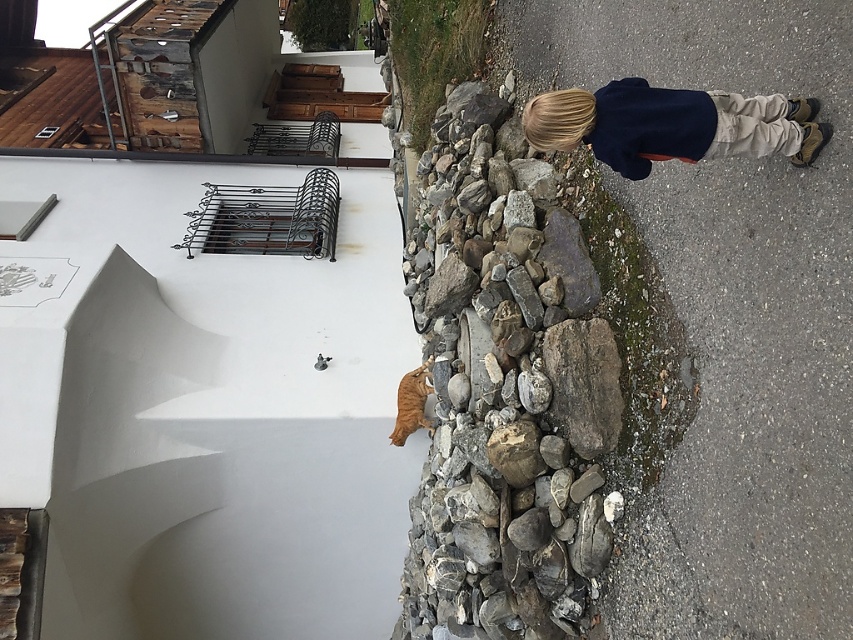
You are a hiker who wants to place your dark blue sweater at upper right on top of the rough gray rock at center. Based on the scene description, will the sweater fit on the rock?

The rough gray rock at center is much taller than the dark blue sweater at upper right, so the sweater will fit on the rock since the rock is larger in height.

In the scene shown: You are a hiker who has just arrived at the scene. You need to place a small backpack between the rough gray rock at center and the dark blue sweater at upper right. According to the scene description, where should you place it?

The rough gray rock at center is positioned on the left side of dark blue sweater at upper right, so you should place the backpack between them, to the right of the rough gray rock at center and to the left of the dark blue sweater at upper right.